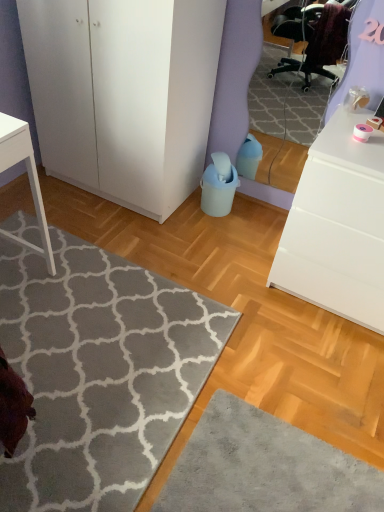
Question: Can you confirm if white matte chest of drawers at right is positioned to the right of white matte cabinet at left?

Choices:
 (A) no
 (B) yes

Answer: (B)

Question: Considering the relative sizes of white matte chest of drawers at right and white matte cabinet at left in the image provided, is white matte chest of drawers at right bigger than white matte cabinet at left?

Choices:
 (A) yes
 (B) no

Answer: (B)

Question: Is white matte chest of drawers at right to the left of white matte cabinet at left from the viewer's perspective?

Choices:
 (A) yes
 (B) no

Answer: (B)

Question: Does white matte chest of drawers at right turn towards white matte cabinet at left?

Choices:
 (A) yes
 (B) no

Answer: (B)

Question: Is white matte chest of drawers at right surrounding white matte cabinet at left?

Choices:
 (A) yes
 (B) no

Answer: (B)

Question: From their relative heights in the image, would you say gray soft rug at lower left is taller or shorter than white matte cabinet at left?

Choices:
 (A) tall
 (B) short

Answer: (B)

Question: Considering their positions, is gray soft rug at lower left located in front of or behind white matte cabinet at left?

Choices:
 (A) front
 (B) behind

Answer: (A)

Question: In terms of width, does gray soft rug at lower left look wider or thinner when compared to white matte cabinet at left?

Choices:
 (A) thin
 (B) wide

Answer: (B)

Question: Based on their sizes in the image, would you say gray soft rug at lower left is bigger or smaller than white matte cabinet at left?

Choices:
 (A) small
 (B) big

Answer: (A)

Question: Is white matte cabinet at left bigger or smaller than white matte chest of drawers at right?

Choices:
 (A) big
 (B) small

Answer: (A)

Question: Is point (180, 187) closer or farther from the camera than point (372, 291)?

Choices:
 (A) farther
 (B) closer

Answer: (A)

Question: From a real-world perspective, is white matte cabinet at left positioned above or below white matte chest of drawers at right?

Choices:
 (A) below
 (B) above

Answer: (B)

Question: Considering the positions of white matte cabinet at left and white matte chest of drawers at right in the image, is white matte cabinet at left taller or shorter than white matte chest of drawers at right?

Choices:
 (A) tall
 (B) short

Answer: (A)

Question: From a real-world perspective, relative to white matte cabinet at left, is white matte chest of drawers at right vertically above or below?

Choices:
 (A) above
 (B) below

Answer: (B)

Question: Considering the positions of point (288, 262) and point (49, 4), is point (288, 262) closer or farther from the camera than point (49, 4)?

Choices:
 (A) closer
 (B) farther

Answer: (B)